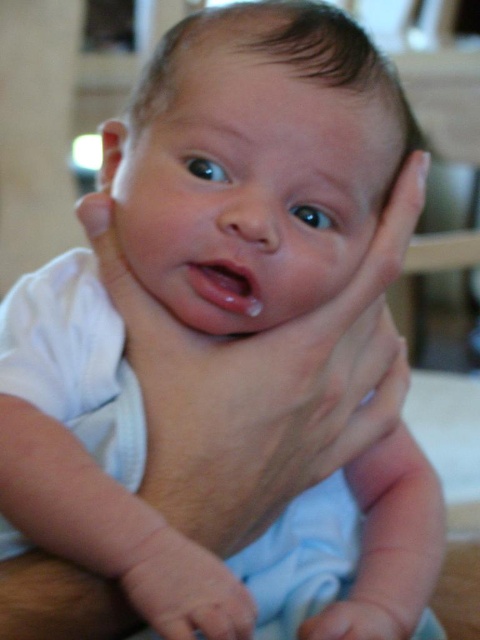
Between smooth skin hand at center and smooth skin hand at lower center, which one appears on the right side from the viewer's perspective?

smooth skin hand at lower center

Does point (144, 564) lie in front of point (395, 612)?

Yes, it is.

You are a GUI agent. You are given a task and a screenshot of the screen. Output one action in this format:
    pyautogui.click(x=<x>, y=<y>)
    Task: Click on the smooth skin hand at center
    The height and width of the screenshot is (640, 480).
    Given the screenshot: What is the action you would take?
    pyautogui.click(x=189, y=593)